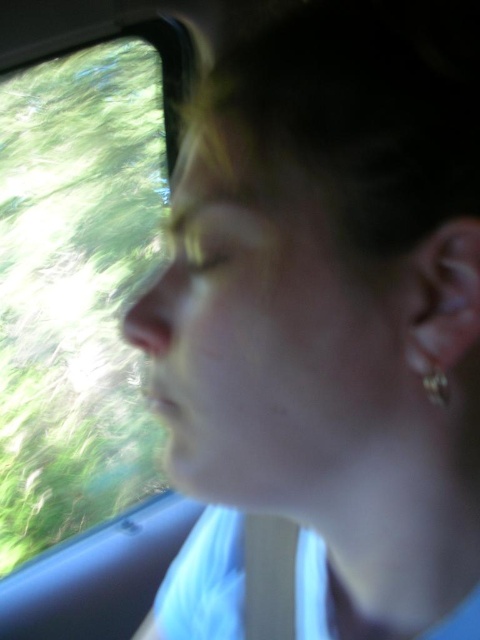
You are a passenger on a moving vehicle and want to look outside through the transparent glass window at left while also checking your reflection in the silver metallic earring at ear. Which object allows you to see a larger image of the outside scenery?

The transparent glass window at left has a larger size compared to the silver metallic earring at ear, so the transparent glass window at left allows you to see a larger image of the outside scenery.

You are a passenger on a moving vehicle and want to check the outside view through the transparent glass window at left while also noticing the silver metallic earring at ear. Which object takes up more space horizontally in the image?

The transparent glass window at left takes up more space horizontally than the silver metallic earring at ear because its width is larger.

You are a passenger on a moving train. You notice a transparent glass window at left and a silver metallic earring at ear. Which object is taller when viewed from your seat?

The transparent glass window at left has a greater height compared to the silver metallic earring at ear, so the transparent glass window at left is taller.